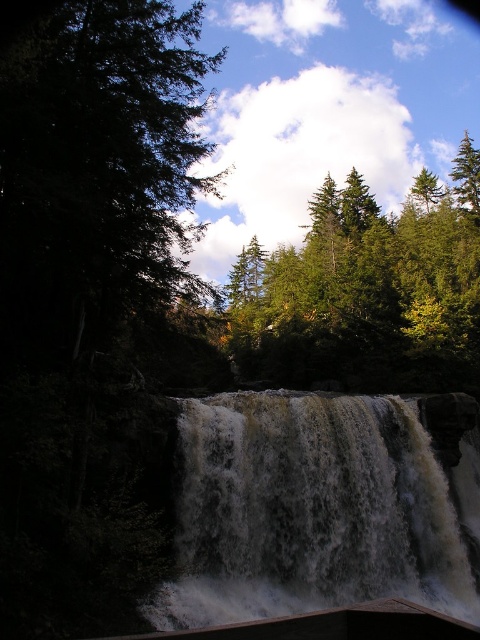
Can you confirm if green leafy tree at left is positioned to the right of white frothy water at center?

Incorrect, green leafy tree at left is not on the right side of white frothy water at center.

Between green leafy tree at left and white frothy water at center, which one is positioned higher?

Positioned higher is green leafy tree at left.

Which is behind, point (168, 77) or point (195, 426)?

The point (195, 426) is more distant.

At what (x,y) coordinates should I click in order to perform the action: click on green leafy tree at left. Please return your answer as a coordinate pair (x, y). This screenshot has height=640, width=480. Looking at the image, I should click on (96, 170).

Who is taller, green leafy tree at left or green matte tree at upper right?

With more height is green leafy tree at left.

From the picture: Between green leafy tree at left and green matte tree at upper right, which one appears on the left side from the viewer's perspective?

Positioned to the left is green leafy tree at left.

Locate an element on the screen. green leafy tree at left is located at coordinates (96, 170).

Can you confirm if green leafy tree at left is taller than green matte tree at upper center?

Correct, green leafy tree at left is much taller as green matte tree at upper center.

Can you confirm if green leafy tree at left is bigger than green matte tree at upper center?

Yes, green leafy tree at left is bigger than green matte tree at upper center.

Which is behind, point (157, 81) or point (459, 228)?

Point (459, 228)

Find the location of a particular element. green leafy tree at left is located at coordinates (96, 170).